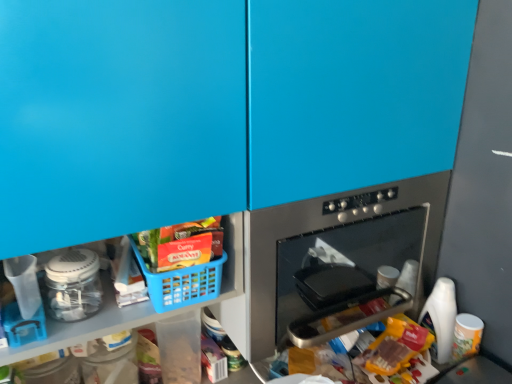
Question: Can you confirm if translucent plastic bag at lower center, the second food in the top-to-bottom sequence, is smaller than matte plastic basket at lower center, placed as the second food when sorted from right to left?

Choices:
 (A) yes
 (B) no

Answer: (B)

Question: Does translucent plastic bag at lower center, arranged as the first food when ordered from the bottom, have a lesser width compared to matte plastic basket at lower center, which appears as the second food when ordered from the bottom?

Choices:
 (A) yes
 (B) no

Answer: (B)

Question: From a real-world perspective, does translucent plastic bag at lower center, the second food in the top-to-bottom sequence, stand above matte plastic basket at lower center, which appears as the second food when ordered from the bottom?

Choices:
 (A) yes
 (B) no

Answer: (B)

Question: From the image's perspective, does translucent plastic bag at lower center, the 2th food viewed from the left, appear higher than matte plastic basket at lower center, which appears as the second food when ordered from the bottom?

Choices:
 (A) no
 (B) yes

Answer: (A)

Question: Is translucent plastic bag at lower center, the second food in the top-to-bottom sequence, not within matte plastic basket at lower center, positioned as the first food in top-to-bottom order?

Choices:
 (A) no
 (B) yes

Answer: (B)

Question: From a real-world perspective, is blue plastic basket at lower left physically located above or below translucent plastic bag at lower center, acting as the first food starting from the right?

Choices:
 (A) above
 (B) below

Answer: (A)

Question: From the image's perspective, is blue plastic basket at lower left positioned above or below translucent plastic bag at lower center, the second food in the top-to-bottom sequence?

Choices:
 (A) above
 (B) below

Answer: (A)

Question: Relative to translucent plastic bag at lower center, arranged as the first food when ordered from the bottom, is blue plastic basket at lower left in front or behind?

Choices:
 (A) behind
 (B) front

Answer: (A)

Question: Is blue plastic basket at lower left taller or shorter than translucent plastic bag at lower center, arranged as the first food when ordered from the bottom?

Choices:
 (A) short
 (B) tall

Answer: (A)

Question: Considering the positions of stainless steel oven at center and blue plastic basket at lower left in the image, is stainless steel oven at center taller or shorter than blue plastic basket at lower left?

Choices:
 (A) short
 (B) tall

Answer: (B)

Question: Is stainless steel oven at center to the left or to the right of blue plastic basket at lower left in the image?

Choices:
 (A) right
 (B) left

Answer: (A)

Question: In terms of width, does stainless steel oven at center look wider or thinner when compared to blue plastic basket at lower left?

Choices:
 (A) thin
 (B) wide

Answer: (B)

Question: Based on their sizes in the image, would you say stainless steel oven at center is bigger or smaller than blue plastic basket at lower left?

Choices:
 (A) small
 (B) big

Answer: (B)

Question: From their relative heights in the image, would you say translucent plastic bag at lower center, arranged as the first food when ordered from the bottom, is taller or shorter than white plastic bottle at lower right?

Choices:
 (A) tall
 (B) short

Answer: (A)

Question: From the image's perspective, is translucent plastic bag at lower center, the 2th food viewed from the left, positioned above or below white plastic bottle at lower right?

Choices:
 (A) below
 (B) above

Answer: (A)